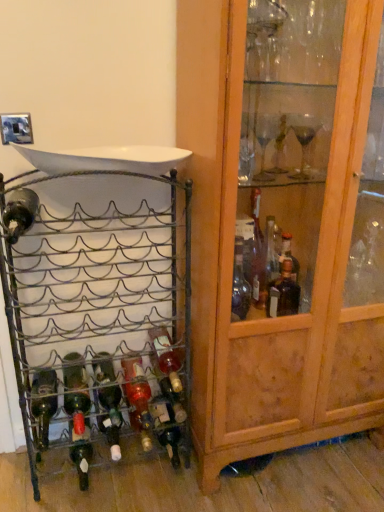
Find the location of a particular element. The height and width of the screenshot is (512, 384). free location in front of translucent glass bottle at lower left, positioned as the third bottle in left-to-right order is located at coordinates (76, 498).